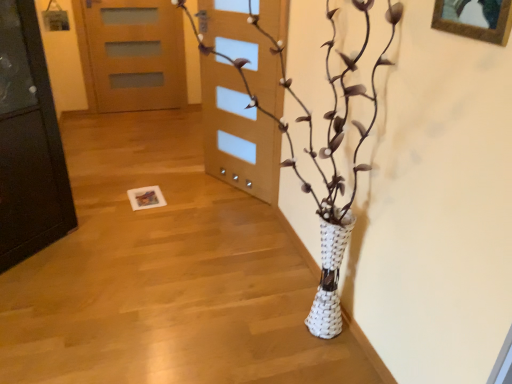
Question: Is wooden picture frame at upper right wider or thinner than wooden door at upper center?

Choices:
 (A) thin
 (B) wide

Answer: (A)

Question: Is point (465, 31) positioned closer to the camera than point (146, 72)?

Choices:
 (A) closer
 (B) farther

Answer: (A)

Question: Considering the real-world distances, which object is closest to the wooden door at upper center?

Choices:
 (A) white woven vase at center
 (B) wooden picture frame at upper right

Answer: (A)

Question: Which object is the farthest from the white woven vase at center?

Choices:
 (A) wooden door at upper center
 (B) wooden picture frame at upper right

Answer: (A)